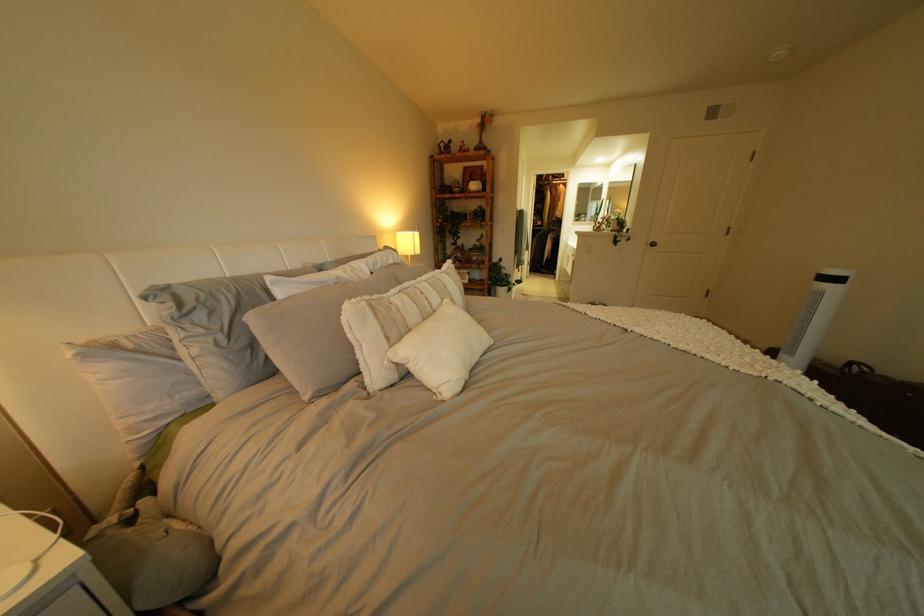
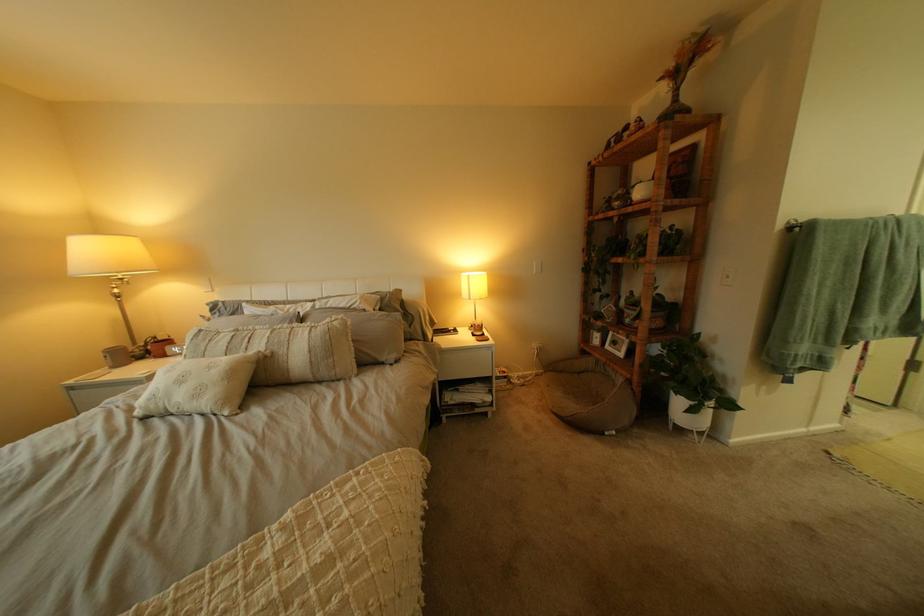
Where in the second image is the point corresponding to (x=495, y=129) from the first image?

(675, 81)